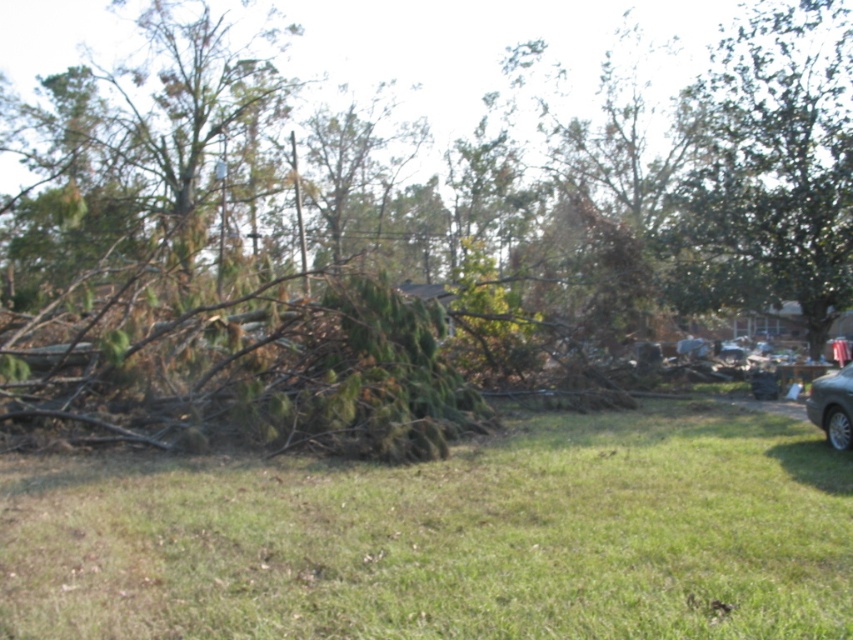
Question: Which of the following is the closest to the observer?

Choices:
 (A) brown wood debris at center
 (B) green leafy tree at upper right
 (C) silver metallic car at lower right

Answer: (A)

Question: Among these objects, which one is nearest to the camera?

Choices:
 (A) brown wood debris at center
 (B) green leafy tree at upper right
 (C) silver metallic car at lower right

Answer: (A)

Question: Which point is farther from the camera taking this photo?

Choices:
 (A) (846, 419)
 (B) (578, 454)

Answer: (B)

Question: Does green leafy tree at upper right appear on the right side of silver metallic car at lower right?

Choices:
 (A) no
 (B) yes

Answer: (B)

Question: Does brown wood debris at center appear on the right side of green leafy tree at upper right?

Choices:
 (A) yes
 (B) no

Answer: (B)

Question: Considering the relative positions of brown wood debris at center and silver metallic car at lower right in the image provided, where is brown wood debris at center located with respect to silver metallic car at lower right?

Choices:
 (A) right
 (B) left

Answer: (B)